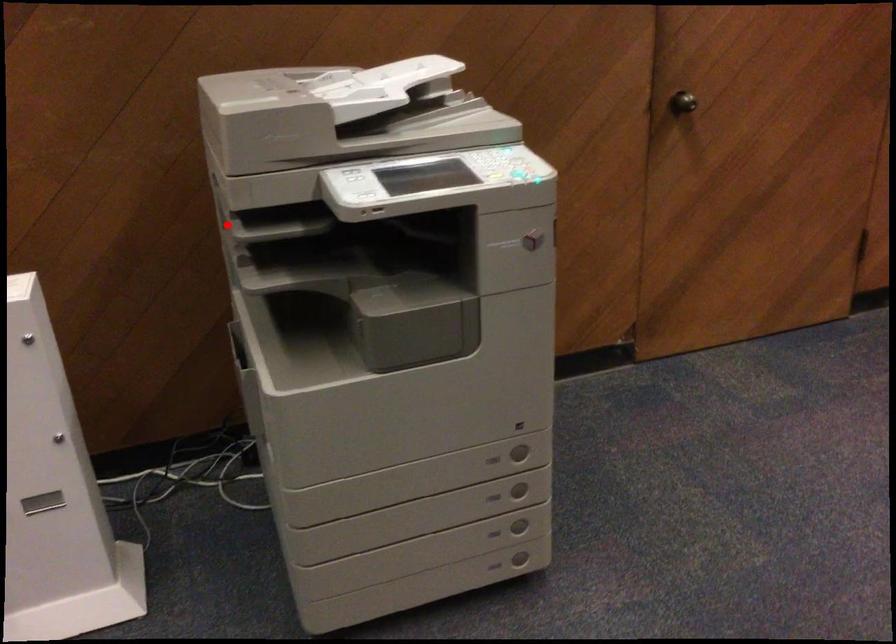
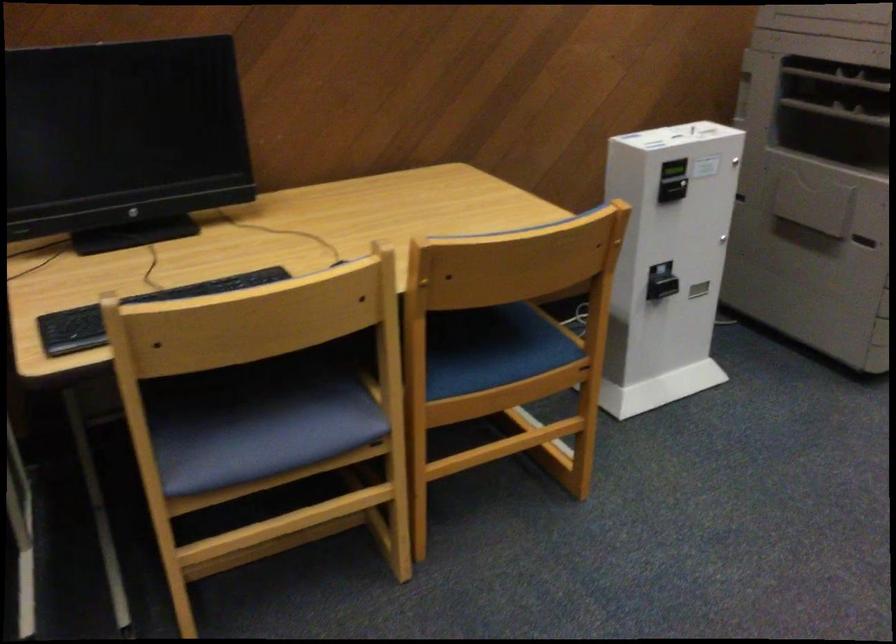
Question: I am providing you with two images of the same scene from different viewpoints. A red point is marked on the first image. At the location where the point appears in image 1, is it still visible in image 2?

Choices:
 (A) Yes
 (B) No

Answer: (A)